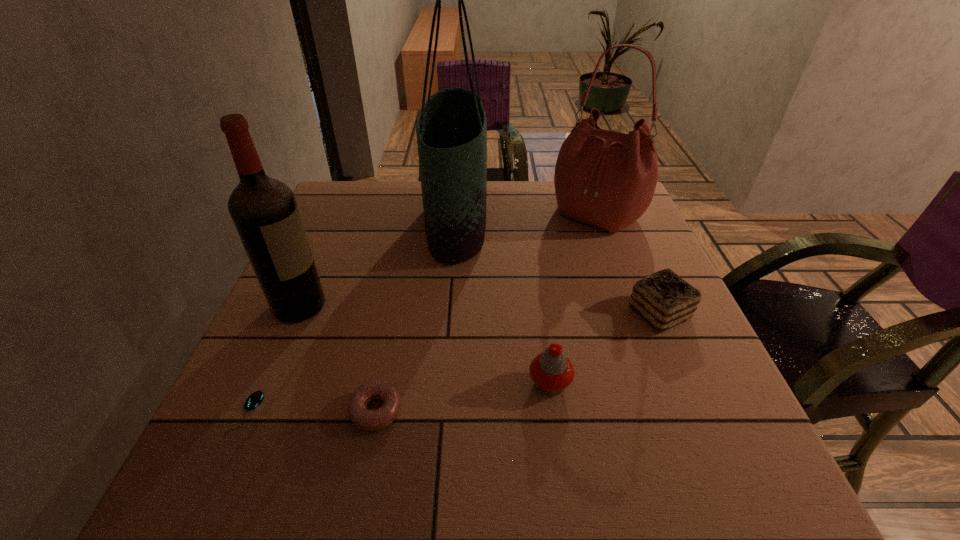
This screenshot has width=960, height=540. Find the location of `tote bag`. tote bag is located at coordinates (451, 128).

Identify the location of handbag. The image size is (960, 540). (607, 179).

What are the coordinates of `liquor` in the screenshot? It's located at (264, 210).

Find the location of a particular element. the third object from right to left is located at coordinates (552, 372).

The image size is (960, 540). Find the location of `chocolate cake`. chocolate cake is located at coordinates (664, 299).

Identify the location of doughnut. (376, 419).

The width and height of the screenshot is (960, 540). I want to click on mouse, so click(255, 399).

Where is `free region located 0.120m on the left of the tallest object`? The width and height of the screenshot is (960, 540). free region located 0.120m on the left of the tallest object is located at coordinates (382, 223).

This screenshot has width=960, height=540. What are the coordinates of `free location located 0.340m on the left of the handbag` in the screenshot? It's located at click(x=427, y=213).

The height and width of the screenshot is (540, 960). I want to click on vacant space located on the front-facing side of the liquor, so click(376, 306).